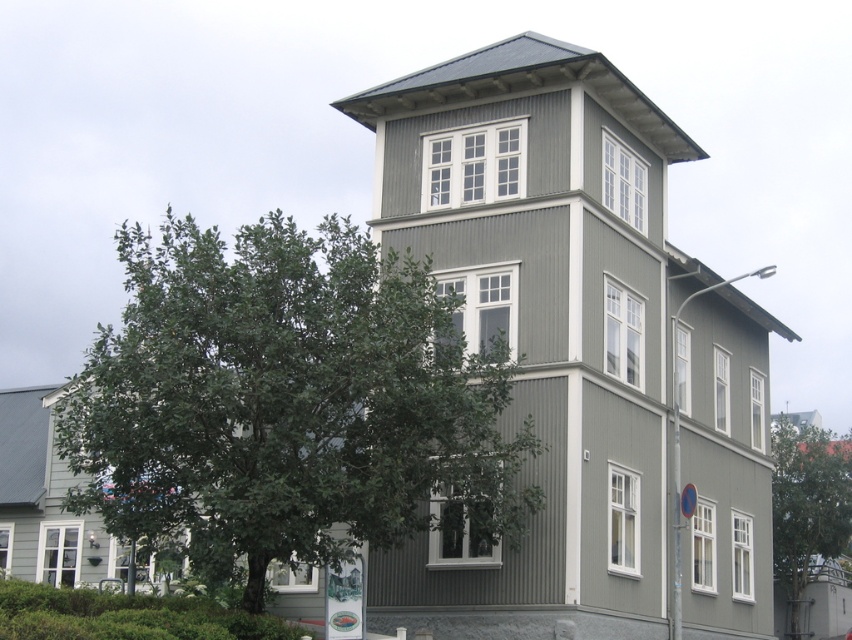
You are a painter standing at the front of the building and want to capture the view. Which tree, the green leafy tree at left or the green leafy tree at lower right, would block more of the building from your perspective?

The green leafy tree at left might block more of the building from your perspective since it is wider than the green leafy tree at lower right.

You are a landscape architect planning to install a new walkway between the two green leafy trees. The walkway must be exactly 140 feet long. Based on the distance between the green leafy tree at left and the green leafy tree at lower right, will the walkway fit perfectly between them?

The green leafy tree at left is 138.80 feet away from the green leafy tree at lower right. Since the walkway needs to be exactly 140 feet long, it will be slightly too long by 1.20 feet to fit perfectly between them.